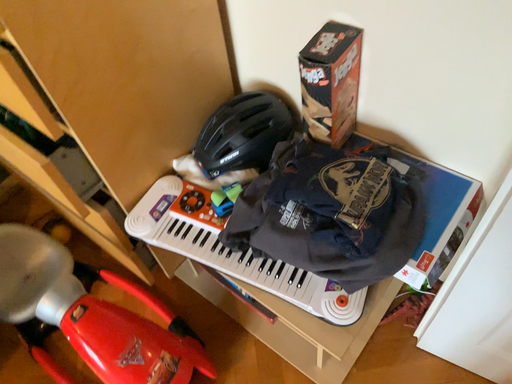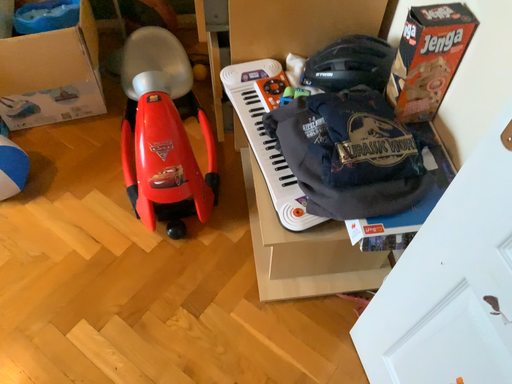
Question: Which way did the camera rotate in the video?

Choices:
 (A) rotated left
 (B) rotated right

Answer: (A)